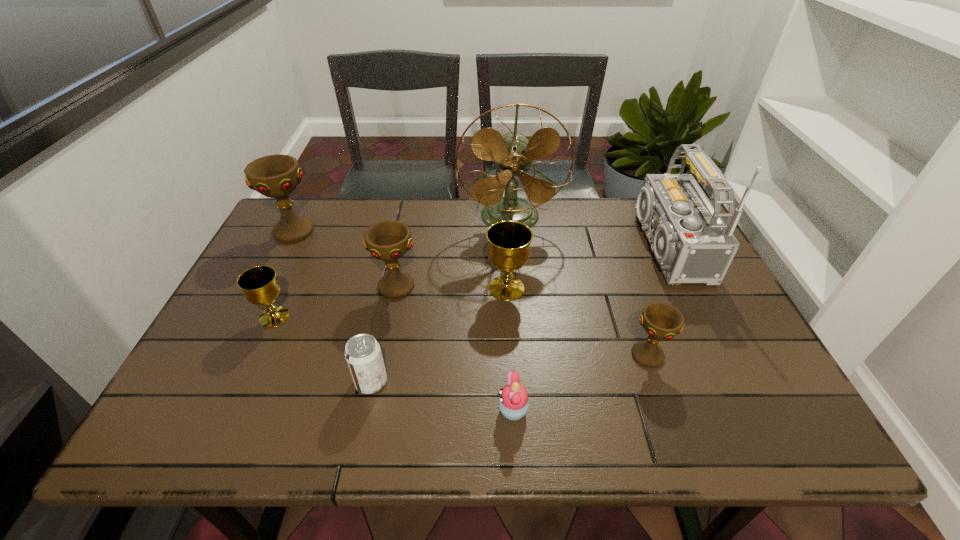
Locate an element on the screen. object present at the near edge is located at coordinates pyautogui.click(x=513, y=402).

You are a GUI agent. You are given a task and a screenshot of the screen. Output one action in this format:
    pyautogui.click(x=<x>, y=<y>)
    Task: Click on the object that is at the right edge
    
    Given the screenshot: What is the action you would take?
    coord(691,242)

The height and width of the screenshot is (540, 960). Find the location of `object positioned at the far left corner`. object positioned at the far left corner is located at coordinates (276, 176).

Identify the location of object located in the far right corner section of the desktop. This screenshot has height=540, width=960. (x=691, y=242).

The image size is (960, 540). I want to click on vacant space at the far edge, so click(590, 235).

Image resolution: width=960 pixels, height=540 pixels. In order to click on vacant region at the near edge of the desktop in this screenshot , I will do `click(705, 443)`.

Locate an element on the screen. vacant space at the left edge is located at coordinates (265, 343).

The width and height of the screenshot is (960, 540). In the image, there is a desktop. Find the location of `vacant space at the right edge`. vacant space at the right edge is located at coordinates (754, 399).

In the image, there is a desktop. Identify the location of vacant space at the near right corner. (754, 421).

At what (x,y) coordinates should I click in order to perform the action: click on vacant region between the second red chalice from left to right and the left gold chalice. Please return your answer as a coordinate pair (x, y). The width and height of the screenshot is (960, 540). Looking at the image, I should click on (335, 302).